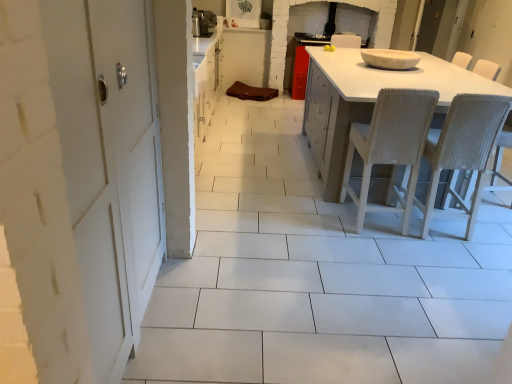
The height and width of the screenshot is (384, 512). What do you see at coordinates (463, 151) in the screenshot? I see `white woven chair at right, the 2th chair viewed from the left` at bounding box center [463, 151].

Locate an element on the screen. This screenshot has height=384, width=512. white matte door at left is located at coordinates (109, 162).

Describe the element at coordinates (369, 100) in the screenshot. I see `white matte table at right` at that location.

Measure the distance between point (314, 123) and camera.

Point (314, 123) is 12.80 feet away from camera.

This screenshot has height=384, width=512. In order to click on white woven chair at right, the 2th chair viewed from the left in this screenshot , I will do `click(463, 151)`.

Would you say woven wood chair at center, which appears as the 1th chair when viewed from the left, is to the left or to the right of white matte door at left in the picture?

woven wood chair at center, which appears as the 1th chair when viewed from the left, is to the right of white matte door at left.

Which of these two, woven wood chair at center, which appears as the 1th chair when viewed from the left, or white matte door at left, is wider?

white matte door at left.

Between woven wood chair at center, which appears as the 1th chair when viewed from the left, and white matte door at left, which one has less height?

woven wood chair at center, which appears as the 1th chair when viewed from the left.

Can you tell me how much woven wood chair at center, the second chair viewed from the right, and white matte door at left differ in facing direction?

The facing directions of woven wood chair at center, the second chair viewed from the right, and white matte door at left are 90.4 degrees apart.

What's the angular difference between woven wood chair at center, which appears as the 1th chair when viewed from the left, and white glossy bowl at center, positioned as the 1th appliance in front-to-back order,'s facing directions?

The angle between the facing direction of woven wood chair at center, which appears as the 1th chair when viewed from the left, and the facing direction of white glossy bowl at center, positioned as the 1th appliance in front-to-back order, is 88.6 degrees.

From the picture: Between woven wood chair at center, the second chair viewed from the right, and white glossy bowl at center, the first appliance in the right-to-left sequence, which one is positioned behind?

white glossy bowl at center, the first appliance in the right-to-left sequence, is more distant.

Could you tell me if woven wood chair at center, which appears as the 1th chair when viewed from the left, is facing white glossy bowl at center, which is the 1th appliance from bottom to top?

Yes.

In the image, is woven wood chair at center, which appears as the 1th chair when viewed from the left, on the left side or the right side of white glossy bowl at center, the first appliance in the right-to-left sequence?

In the image, woven wood chair at center, which appears as the 1th chair when viewed from the left, appears on the left side of white glossy bowl at center, the first appliance in the right-to-left sequence.

Is brown fabric at center wider than white glossy bowl at center, positioned as the 1th appliance in front-to-back order?

Yes.

Is brown fabric at center outside of white glossy bowl at center, the second appliance when ordered from back to front?

Indeed, brown fabric at center is completely outside white glossy bowl at center, the second appliance when ordered from back to front.

Identify the location of appliance below the brown fabric at center (from the image's perspective). The image size is (512, 384). (390, 59).

Is brown fabric at center looking in the opposite direction of white glossy bowl at center, which ranks as the second appliance in top-to-bottom order?

No, brown fabric at center is not facing the opposite direction of white glossy bowl at center, which ranks as the second appliance in top-to-bottom order.

From the picture: Is metallic silver toaster at upper center, which appears as the 2th appliance when viewed from the front, positioned far away from white woven chair at right, the first chair viewed from the right?

Indeed, metallic silver toaster at upper center, which appears as the 2th appliance when viewed from the front, is not near white woven chair at right, the first chair viewed from the right.

Is metallic silver toaster at upper center, which is the 2th appliance in bottom-to-top order, oriented towards white woven chair at right, the 2th chair viewed from the left?

Yes, metallic silver toaster at upper center, which is the 2th appliance in bottom-to-top order, is aimed at white woven chair at right, the 2th chair viewed from the left.

Does point (199, 23) lie behind point (478, 122)?

That is True.

Who is shorter, metallic silver toaster at upper center, which appears as the 2th appliance when viewed from the front, or white woven chair at right, the 2th chair viewed from the left?

With less height is metallic silver toaster at upper center, which appears as the 2th appliance when viewed from the front.

Considering the sizes of white matte table at right and white matte door at left in the image, is white matte table at right bigger or smaller than white matte door at left?

white matte table at right is bigger than white matte door at left.

The image size is (512, 384). Identify the location of table lying on the right of white matte door at left. (369, 100).

From the image's perspective, is white matte table at right above white matte door at left?

Yes, from the image's perspective, white matte table at right is above white matte door at left.

Is white glossy bowl at center, the second appliance when ordered from back to front, further to the viewer compared to white matte table at right?

That is True.

Could you tell me if white glossy bowl at center, which ranks as the second appliance in top-to-bottom order, is facing white matte table at right?

No, white glossy bowl at center, which ranks as the second appliance in top-to-bottom order, is not oriented towards white matte table at right.

Is white glossy bowl at center, which ranks as the second appliance in top-to-bottom order, to the left of white matte table at right from the viewer's perspective?

Yes.

Consider the image. Is white glossy bowl at center, which is the 2th appliance from left to right, bigger or smaller than white matte table at right?

white glossy bowl at center, which is the 2th appliance from left to right, is smaller than white matte table at right.

Consider the image. From the image's perspective, is woven wood chair at center, the second chair viewed from the right, positioned above or below white woven chair at right, the first chair viewed from the right?

woven wood chair at center, the second chair viewed from the right, is situated higher than white woven chair at right, the first chair viewed from the right, in the image.

Considering the positions of objects woven wood chair at center, the second chair viewed from the right, and white woven chair at right, the 2th chair viewed from the left, in the image provided, who is more to the left, woven wood chair at center, the second chair viewed from the right, or white woven chair at right, the 2th chair viewed from the left,?

From the viewer's perspective, woven wood chair at center, the second chair viewed from the right, appears more on the left side.

Can you confirm if woven wood chair at center, which appears as the 1th chair when viewed from the left, is bigger than white woven chair at right, the first chair viewed from the right?

Indeed, woven wood chair at center, which appears as the 1th chair when viewed from the left, has a larger size compared to white woven chair at right, the first chair viewed from the right.

In terms of width, does woven wood chair at center, the second chair viewed from the right, look wider or thinner when compared to white woven chair at right, the 2th chair viewed from the left?

woven wood chair at center, the second chair viewed from the right, is thinner than white woven chair at right, the 2th chair viewed from the left.

Locate an element on the screen. chair that is the 2nd one when counting backward from the white matte door at left is located at coordinates (390, 147).

From the image's perspective, count 1st chairs downward from the white glossy bowl at center, which is the 1th appliance from bottom to top, and point to it. Please provide its 2D coordinates.

[(390, 147)]

In the scene shown: From the image, which object appears to be farther from woven wood chair at center, which appears as the 1th chair when viewed from the left, white matte table at right or white matte door at left?

Based on the image, white matte door at left appears to be further to woven wood chair at center, which appears as the 1th chair when viewed from the left.

Consider the image. Estimate the real-world distances between objects in this image. Which object is further from metallic silver toaster at upper center, the first appliance when ordered from back to front, woven wood chair at center, the second chair viewed from the right, or white woven chair at right, the first chair viewed from the right?

white woven chair at right, the first chair viewed from the right.

Considering their positions, is white matte table at right positioned further to metallic silver toaster at upper center, the 1th appliance when ordered from top to bottom, than woven wood chair at center, which appears as the 1th chair when viewed from the left?

The object further to metallic silver toaster at upper center, the 1th appliance when ordered from top to bottom, is woven wood chair at center, which appears as the 1th chair when viewed from the left.

Looking at the image, which one is located closer to white matte door at left, white matte table at right or white woven chair at right, the first chair viewed from the right?

Based on the image, white matte table at right appears to be nearer to white matte door at left.

Estimate the real-world distances between objects in this image. Which object is closer to white woven chair at right, the 2th chair viewed from the left, brown fabric at center or white glossy bowl at center, positioned as the 1th appliance in front-to-back order?

The object closer to white woven chair at right, the 2th chair viewed from the left, is white glossy bowl at center, positioned as the 1th appliance in front-to-back order.

Which object lies further to the anchor point woven wood chair at center, which appears as the 1th chair when viewed from the left, white matte table at right or white woven chair at right, the 2th chair viewed from the left?

Answer: white matte table at right is further to woven wood chair at center, which appears as the 1th chair when viewed from the left.

Looking at the image, which one is located closer to white matte table at right, white glossy bowl at center, which is the 2th appliance from left to right, or white woven chair at right, the 2th chair viewed from the left?

white glossy bowl at center, which is the 2th appliance from left to right, lies closer to white matte table at right than the other object.

In the scene shown: When comparing their distances from metallic silver toaster at upper center, the first appliance when ordered from back to front, does white matte door at left or woven wood chair at center, which appears as the 1th chair when viewed from the left, seem closer?

woven wood chair at center, which appears as the 1th chair when viewed from the left, is positioned closer to the anchor metallic silver toaster at upper center, the first appliance when ordered from back to front.

You are a GUI agent. You are given a task and a screenshot of the screen. Output one action in this format:
    pyautogui.click(x=<x>, y=<y>)
    Task: Click on the appliance located between woven wood chair at center, which appears as the 1th chair when viewed from the left, and metallic silver toaster at upper center, the first appliance when ordered from back to front, in the depth direction
    
    Given the screenshot: What is the action you would take?
    pyautogui.click(x=390, y=59)

Where is `table positioned between white matte door at left and white glossy bowl at center, which is the 2th appliance from left to right, from near to far`? Image resolution: width=512 pixels, height=384 pixels. table positioned between white matte door at left and white glossy bowl at center, which is the 2th appliance from left to right, from near to far is located at coordinates (369, 100).

Where is `appliance positioned between white glossy bowl at center, the first appliance in the right-to-left sequence, and brown fabric at center from near to far`? appliance positioned between white glossy bowl at center, the first appliance in the right-to-left sequence, and brown fabric at center from near to far is located at coordinates (203, 23).

Image resolution: width=512 pixels, height=384 pixels. What are the coordinates of `chair between white matte door at left and white woven chair at right, the first chair viewed from the right` in the screenshot? It's located at (390, 147).